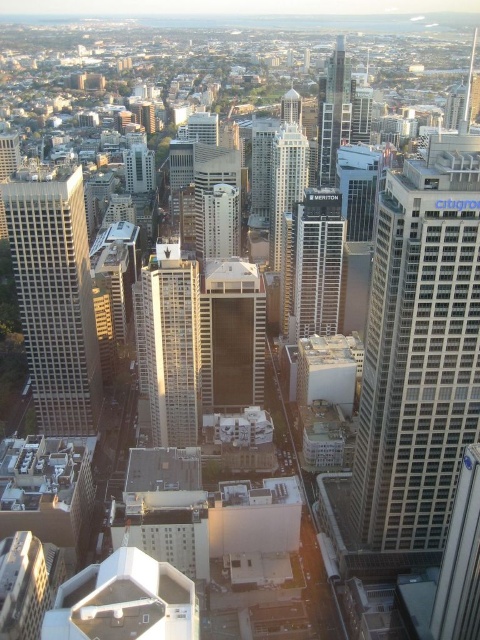
You are a drone operator tasked with capturing aerial footage of the city. You need to fly your drone between the glassy silver skyscraper at center and the shiny glass skyscraper at center. Which skyscraper should you fly your drone under to ensure it has enough clearance?

The glassy silver skyscraper at center is shorter than the shiny glass skyscraper at center, so you should fly the drone under the glassy silver skyscraper at center to ensure sufficient clearance.

You are a city planner analyzing the urban layout. Given the scene, which of the two skyscrapers, the matte glass skyscraper at left or the metallic glass skyscraper at center, has a greater height?

The metallic glass skyscraper at center is taller than the matte glass skyscraper at left.

Consider the image. You are a drone operator who needs to deliver a package to the white glass skyscraper at right. Your drone has a maximum flight range of 0.9 units. Can you reach the point marked at coordinate [420,349] from your current position at coordinate 0.0, 0.0?

The point marked at coordinate [420,349] is the white glass skyscraper at right. Using the distance formula, the distance between 0.0, 0.0 and [420,349] is sqrt 0.547 squared plus 0.875 squared equals approximately 1.03 units. Since this exceeds the drone maximum flight range of 0.9 units, the drone cannot reach the point marked at coordinate [420,349].